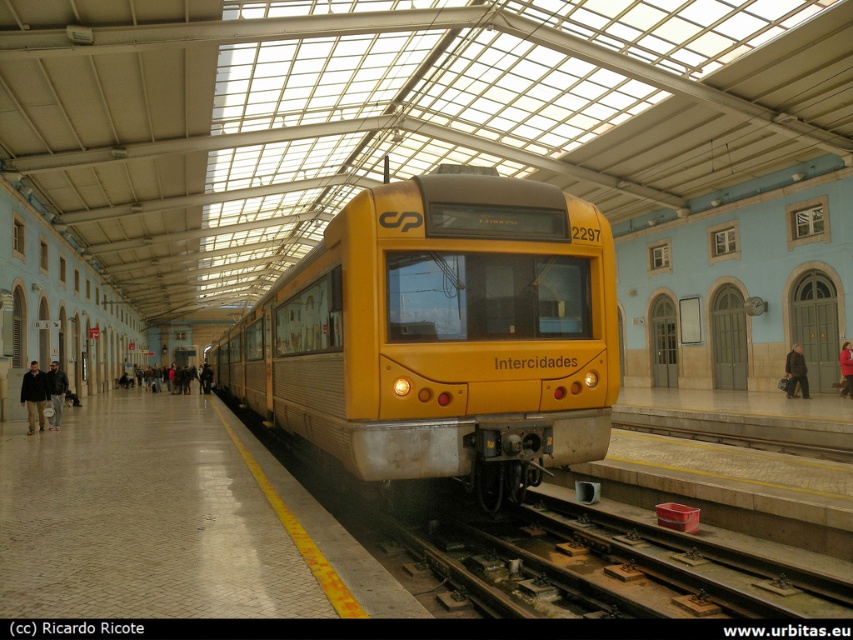
You are a maintenance worker needing to move a 3m wide equipment cart from one end of the platform to the other. Given the yellow matte train at center is currently occupying part of the platform, will the remaining space on the smooth concrete platform at center be sufficient for moving the cart?

The yellow matte train at center is wider than the smooth concrete platform at center, so the remaining space may not be sufficient for moving the 3m wide equipment cart. Check the available space before proceeding.

You are a traveler standing at the platform and see both the dark brown leather jacket at lower left and the dark brown leather coat at right. Which one is positioned more to the left side of the platform?

The dark brown leather jacket at lower left is positioned more to the left side of the platform than the dark brown leather coat at right.

You are standing at the entrance of the train station and want to board the Intercidades train numbered 2297. The train is currently at the platform with its front facing you. To reach the train, you need to walk along the platform. According to the station layout, where should you walk to find the metallic track at center that leads directly to the train?

The metallic track at center is located at point [610,560], so you should walk towards that coordinate to find the track leading directly to the train.